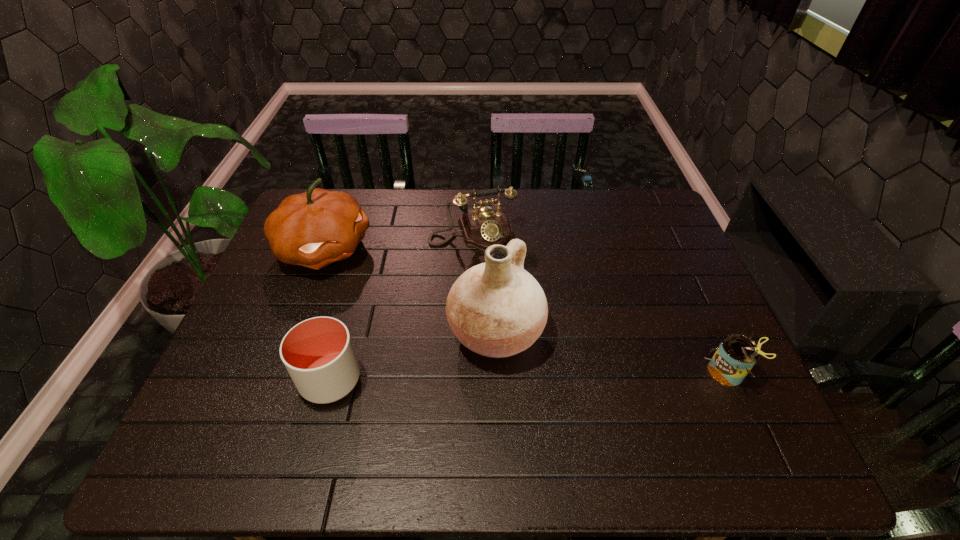
Identify the location of vacant space on the desktop that is between the cup and the rightmost object and is positioned to pour from the handle of the tallest object. This screenshot has height=540, width=960. (588, 375).

The image size is (960, 540). In order to click on vacant space on the desktop that is between the cup and the rightmost object and is positioned on the front face of the pumpkin in this screenshot , I will do `click(543, 376)`.

Find the location of a particular element. vacant space on the desktop that is between the cup and the rightmost object and is positioned on the dial of the telephone is located at coordinates (524, 376).